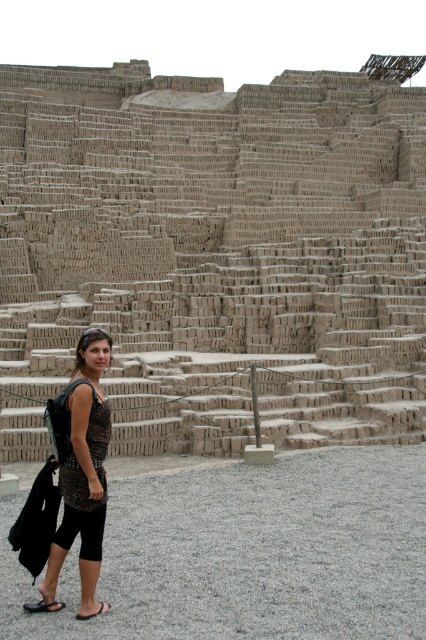
Question: Which object appears closest to the camera in this image?

Choices:
 (A) brown leather sandal at lower left
 (B) black rubber sandal at lower left
 (C) brown clay stairs at center

Answer: (A)

Question: Which point is closer to the camera?

Choices:
 (A) black rubber sandal at lower left
 (B) brown leather sandal at lower left

Answer: (B)

Question: Is black rubber sandal at lower left smaller than brown leather sandal at lower left?

Choices:
 (A) yes
 (B) no

Answer: (B)

Question: Considering the real-world distances, which object is closest to the brown leather sandal at lower left?

Choices:
 (A) black rubber sandal at lower left
 (B) leopard print dress at center

Answer: (A)

Question: Does leopard print dress at center come in front of black rubber sandal at lower left?

Choices:
 (A) no
 (B) yes

Answer: (B)

Question: Does brown clay stairs at center have a larger size compared to black rubber sandal at lower left?

Choices:
 (A) no
 (B) yes

Answer: (B)